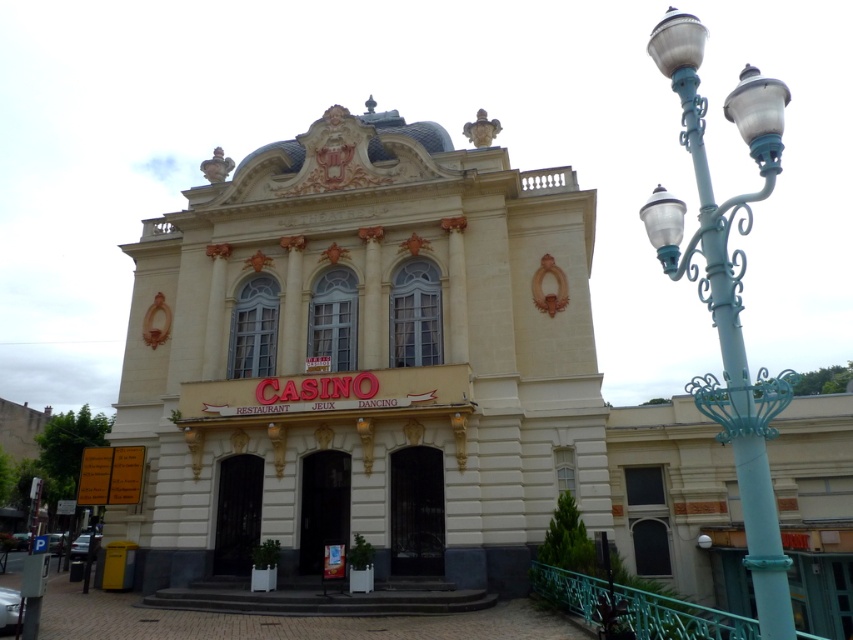
Consider the image. Does dark glass door at center have a lesser width compared to black glass door at center?

Indeed, dark glass door at center has a lesser width compared to black glass door at center.

Does dark glass door at center have a larger size compared to black glass door at center?

Indeed, dark glass door at center has a larger size compared to black glass door at center.

Is point (430, 500) closer to viewer compared to point (305, 460)?

Yes, it is in front of point (305, 460).

Where is `dark glass door at center`? dark glass door at center is located at coordinates (416, 512).

Does teal metal railing at lower center have a greater height compared to black metal door at center?

Yes.

Can you confirm if teal metal railing at lower center is shorter than black metal door at center?

No, teal metal railing at lower center is not shorter than black metal door at center.

Which is behind, point (717, 627) or point (224, 524)?

Positioned behind is point (224, 524).

The image size is (853, 640). Identify the location of teal metal railing at lower center. (682, 618).

Does point (457, 353) lie behind point (305, 508)?

Yes, it is behind point (305, 508).

Which of these two, white stone theater at center or black glass door at center, stands taller?

white stone theater at center is taller.

Where is `white stone theater at center`? white stone theater at center is located at coordinates pos(364,344).

Where is `white stone theater at center`? The height and width of the screenshot is (640, 853). white stone theater at center is located at coordinates (364, 344).